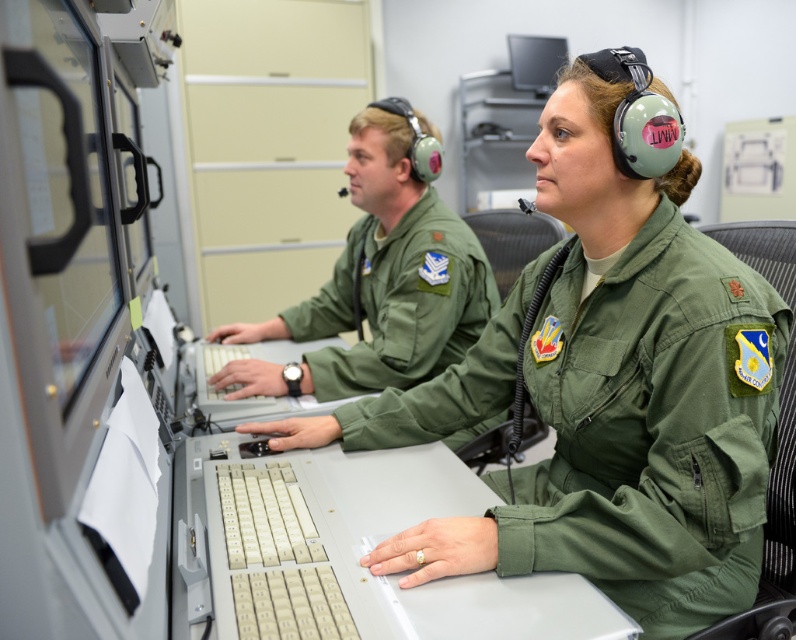
Between green fabric uniform at center and green matte uniform at center, which one is positioned lower?

green fabric uniform at center

The width and height of the screenshot is (796, 640). What are the coordinates of `green fabric uniform at center` in the screenshot? It's located at (605, 387).

Between green fabric uniform at center and black glossy monitor at upper center, which one is positioned higher?

black glossy monitor at upper center is higher up.

Is point (623, 540) closer to viewer compared to point (547, 44)?

Yes, it is.

Locate an element on the screen. The image size is (796, 640). green fabric uniform at center is located at coordinates (605, 387).

Is point (449, 348) positioned before point (558, 58)?

Yes, point (449, 348) is in front of point (558, 58).

From the picture: Is green matte uniform at center positioned before black glossy monitor at upper center?

Yes.

Is point (387, 301) closer to camera compared to point (540, 76)?

Yes, it is in front of point (540, 76).

Where is `green matte uniform at center`? Image resolution: width=796 pixels, height=640 pixels. green matte uniform at center is located at coordinates (380, 278).